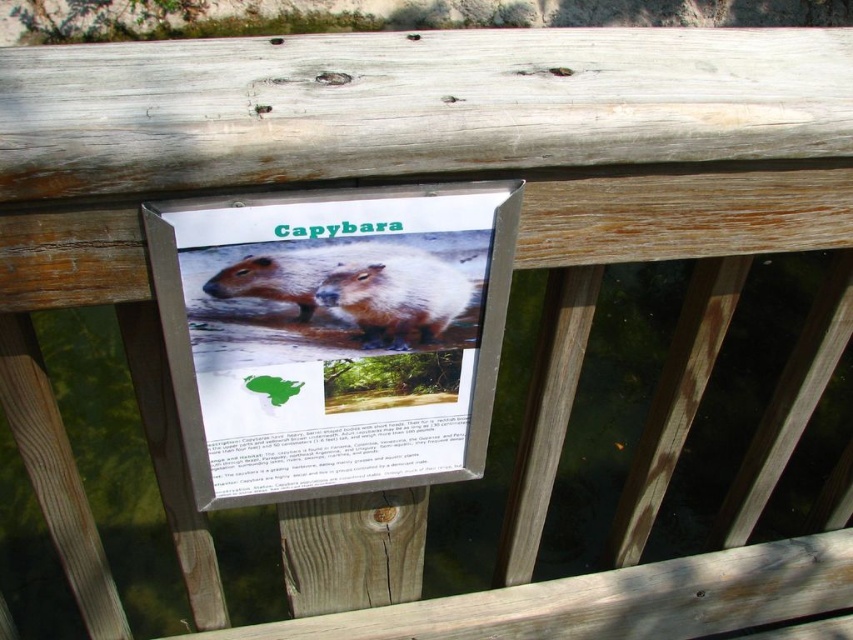
Does brown furry beaver at center have a greater width compared to brown furry capybara at center?

Incorrect, brown furry beaver at center's width does not surpass brown furry capybara at center's.

Is brown furry beaver at center in front of brown furry capybara at center?

No, brown furry beaver at center is behind brown furry capybara at center.

Is point (389, 260) positioned before point (236, 288)?

That is False.

Locate an element on the screen. brown furry beaver at center is located at coordinates (397, 298).

Who is taller, metal sign at center or brown furry beaver at center?

With more height is metal sign at center.

Describe the element at coordinates (334, 336) in the screenshot. I see `metal sign at center` at that location.

Where is `metal sign at center`? metal sign at center is located at coordinates (334, 336).

Who is positioned more to the left, metal sign at center or brown furry capybara at center?

From the viewer's perspective, brown furry capybara at center appears more on the left side.

Does metal sign at center lie in front of brown furry capybara at center?

Yes, it is in front of brown furry capybara at center.

Locate an element on the screen. metal sign at center is located at coordinates (334, 336).

What are the coordinates of `metal sign at center` in the screenshot? It's located at (334, 336).